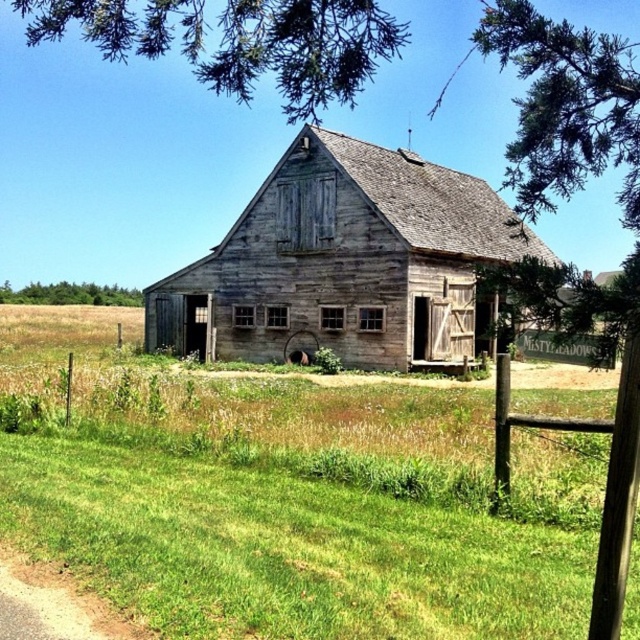
The height and width of the screenshot is (640, 640). Identify the location of green grass at center. (288, 497).

Is point (227, 588) positioned behind point (51, 284)?

No, it is in front of (51, 284).

Where is `green grass at center`? This screenshot has width=640, height=640. green grass at center is located at coordinates (288, 497).

Between point (8, 442) and point (163, 122), which one is positioned in front?

Positioned in front is point (8, 442).

Is point (504, 636) closer to camera compared to point (508, 122)?

Yes, point (504, 636) is in front of point (508, 122).

Identify the location of green grass at center. This screenshot has width=640, height=640. (288, 497).

Is green grass at center above weathered wood barn at center?

Actually, green grass at center is below weathered wood barn at center.

Does point (380, 467) come in front of point (148, 289)?

Yes.

Find the location of `green grass at center`. green grass at center is located at coordinates (288, 497).

Where is `green grass at center`? green grass at center is located at coordinates (288, 497).